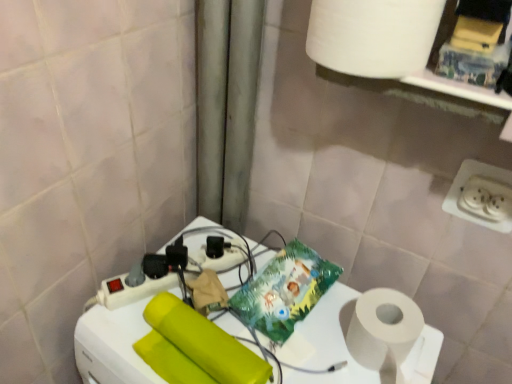
Question: Should I look upward or downward to see matte yellow toilet paper at center?

Choices:
 (A) up
 (B) down

Answer: (B)

Question: Is white plastic power strip at center thinner than white plastic power plugs and sockets at lower right?

Choices:
 (A) yes
 (B) no

Answer: (B)

Question: Is white plastic power strip at center behind white plastic power plugs and sockets at lower right?

Choices:
 (A) yes
 (B) no

Answer: (B)

Question: From the image's perspective, is white plastic power strip at center beneath white plastic power plugs and sockets at lower right?

Choices:
 (A) yes
 (B) no

Answer: (A)

Question: Is white plastic power strip at center next to white plastic power plugs and sockets at lower right and touching it?

Choices:
 (A) yes
 (B) no

Answer: (B)

Question: Can you confirm if white plastic power strip at center is bigger than white plastic power plugs and sockets at lower right?

Choices:
 (A) no
 (B) yes

Answer: (B)

Question: Are white plastic power strip at center and white plastic power plugs and sockets at lower right far apart?

Choices:
 (A) no
 (B) yes

Answer: (A)

Question: From the image's perspective, does white plastic power plugs and sockets at lower right appear higher than white matte paper towel at upper right?

Choices:
 (A) no
 (B) yes

Answer: (A)

Question: Is white plastic power plugs and sockets at lower right positioned in front of white matte paper towel at upper right?

Choices:
 (A) no
 (B) yes

Answer: (A)

Question: Can you confirm if white plastic power plugs and sockets at lower right is wider than white matte paper towel at upper right?

Choices:
 (A) yes
 (B) no

Answer: (B)

Question: Is white plastic power plugs and sockets at lower right aimed at white matte paper towel at upper right?

Choices:
 (A) yes
 (B) no

Answer: (B)

Question: From a real-world perspective, is white plastic power plugs and sockets at lower right located higher than white matte paper towel at upper right?

Choices:
 (A) yes
 (B) no

Answer: (B)

Question: Is white plastic power plugs and sockets at lower right bigger than white matte paper towel at upper right?

Choices:
 (A) no
 (B) yes

Answer: (A)

Question: Considering the relative sizes of white plastic power strip at center and matte yellow toilet paper at center in the image provided, is white plastic power strip at center bigger than matte yellow toilet paper at center?

Choices:
 (A) yes
 (B) no

Answer: (A)